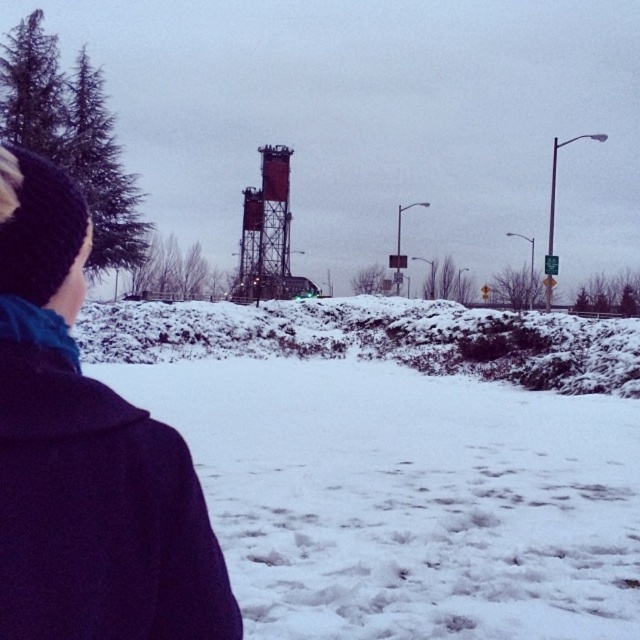
Which is below, dark blue woolen coat at left or metallic water tower at center?

dark blue woolen coat at left is lower down.

Is the position of dark blue woolen coat at left less distant than that of metallic water tower at center?

Yes, dark blue woolen coat at left is in front of metallic water tower at center.

Between point (16, 476) and point (268, 275), which one is positioned in front?

Point (16, 476) is in front.

Where is `dark blue woolen coat at left`? Image resolution: width=640 pixels, height=640 pixels. dark blue woolen coat at left is located at coordinates 96,506.